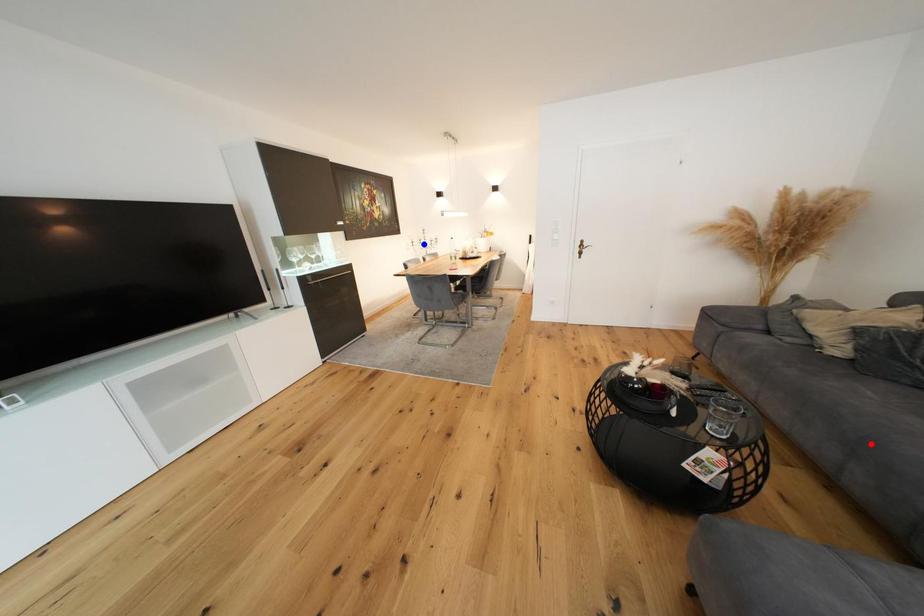
Question: In the image, two points are highlighted. Which point is nearer to the camera? Reply with the corresponding letter.

Choices:
 (A) blue point
 (B) red point

Answer: (B)